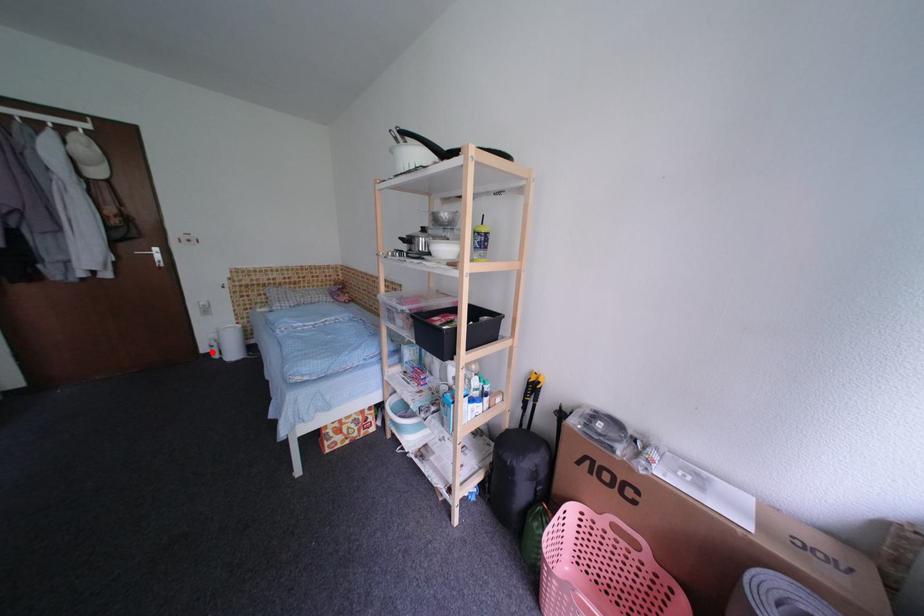
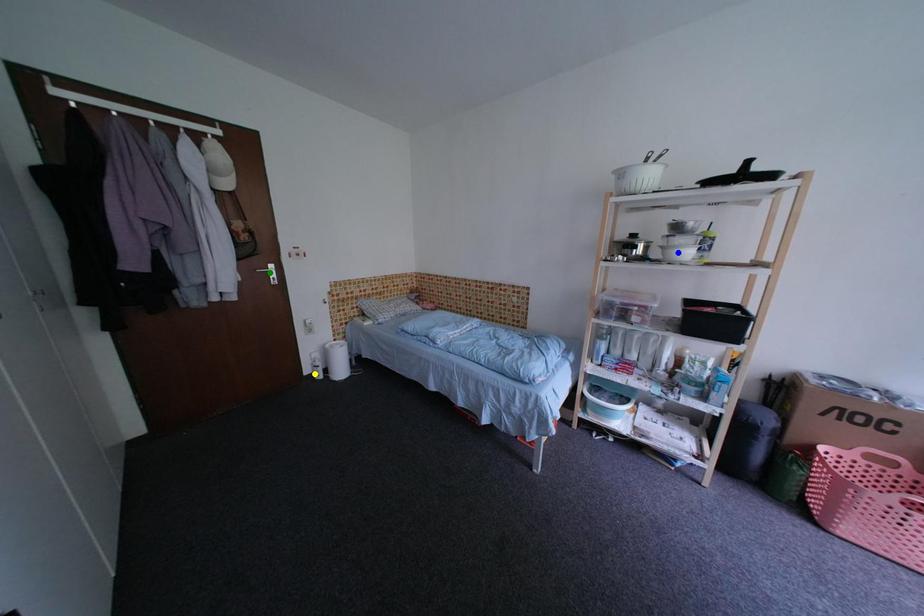
Question: I am providing you with two images of the same scene from different viewpoints. A red point is marked on the first image. You are given multiple points on the second image. Which point in image 2 represents the same 3d spot as the red point in image 1?

Choices:
 (A) yellow point
 (B) green point
 (C) blue point

Answer: (A)